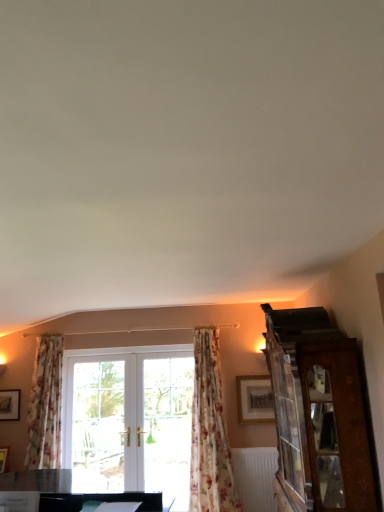
Question: From a real-world perspective, is matte gold picture frame at upper right, the first picture frame viewed from the front, above or below clear glass door at center?

Choices:
 (A) above
 (B) below

Answer: (A)

Question: Relative to clear glass door at center, is matte gold picture frame at upper right, the 2th picture frame when ordered from back to front, in front or behind?

Choices:
 (A) behind
 (B) front

Answer: (B)

Question: Which of these objects is positioned closest to the clear glass door at center?

Choices:
 (A) white textured radiator at lower center
 (B) matte gold picture frame at upper right, positioned as the 1th picture frame in right-to-left order
 (C) wooden picture frame at lower left, which is the second picture frame in front-to-back order
 (D) floral fabric curtain at left, which appears as the first curtain when viewed from the left
 (E) wooden cabinet at right

Answer: (B)

Question: Which is farther from the white textured radiator at lower center?

Choices:
 (A) clear glass door at center
 (B) wooden picture frame at lower left, which is the second picture frame in front-to-back order
 (C) floral fabric curtain at center, placed as the second curtain when sorted from left to right
 (D) wooden cabinet at right
 (E) matte gold picture frame at upper right, the 2th picture frame when ordered from back to front

Answer: (B)